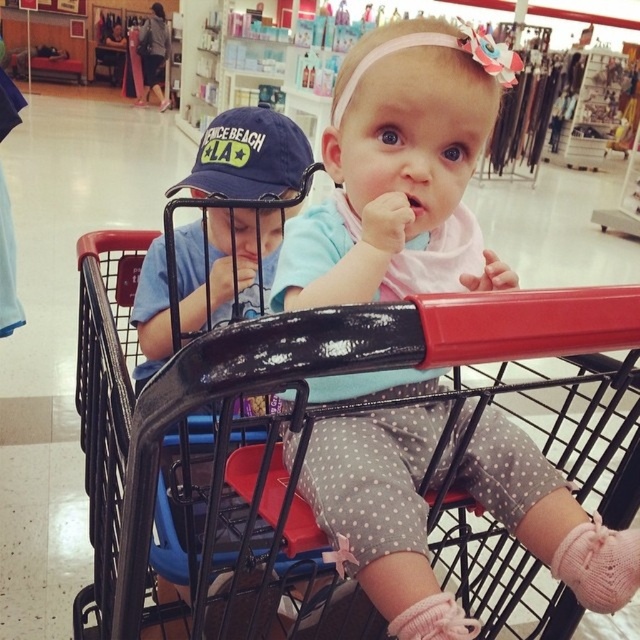
You are a parent in the store looking at the two children in the shopping cart. Which item is positioned lower between the polka dot leggings at center and the blue fabric baseball cap at upper center?

The polka dot leggings at center is located below the blue fabric baseball cap at upper center, so the polka dot leggings at center is positioned lower.

You are a store employee who needs to place a 16 inch wide box between the polka dot leggings at center and the blue fabric baseball cap at upper center. Can you fit the box between them?

The polka dot leggings at center and blue fabric baseball cap at upper center are 15.56 inches apart, so the 16 inch wide box cannot fit between them as the distance is slightly less than the box width.

You are a parent trying to decide if your child can stand up inside the black plastic shopping cart at center while wearing the polka dot leggings at center. Based on their heights, will the child be able to stand without hitting their head?

The polka dot leggings at center is not as tall as the black plastic shopping cart at center, meaning the child wearing them is shorter than the cart. Therefore, the child should be able to stand inside the black plastic shopping cart at center without hitting their head.